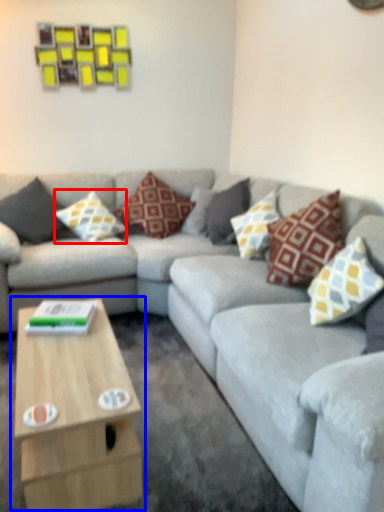
Question: Which object is further to the camera taking this photo, pillow (highlighted by a red box) or coffee table (highlighted by a blue box)?

Choices:
 (A) pillow
 (B) coffee table

Answer: (A)